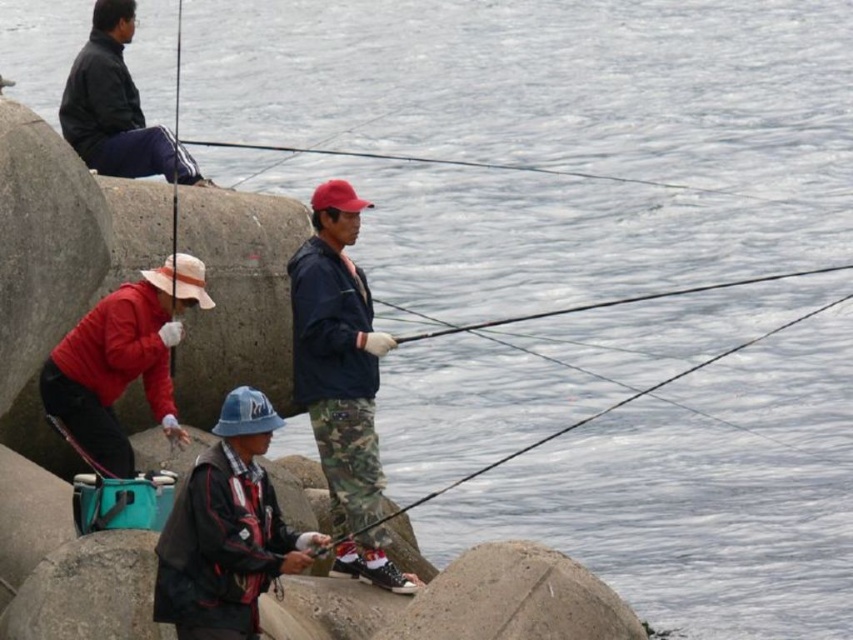
Between point (469, 324) and point (177, 22), which one is positioned in front?

Point (469, 324)

Measure the distance from smooth black rod at center to matte black fishing pole at upper left.

21.76 meters

The image size is (853, 640). In order to click on smooth black rod at center in this screenshot , I will do `click(616, 301)`.

Does camouflage fishing pole at center come behind smooth black rod at center?

No, camouflage fishing pole at center is in front of smooth black rod at center.

Is camouflage fishing pole at center closer to camera compared to smooth black rod at center?

Yes, camouflage fishing pole at center is closer to the viewer.

The width and height of the screenshot is (853, 640). Identify the location of camouflage fishing pole at center. (567, 429).

What do you see at coordinates (115, 108) in the screenshot? I see `matte black jacket at upper left` at bounding box center [115, 108].

Image resolution: width=853 pixels, height=640 pixels. Identify the location of matte black jacket at upper left. (115, 108).

In order to click on matte black jacket at upper left in this screenshot , I will do tap(115, 108).